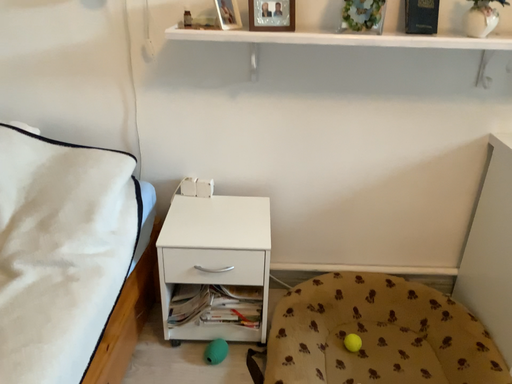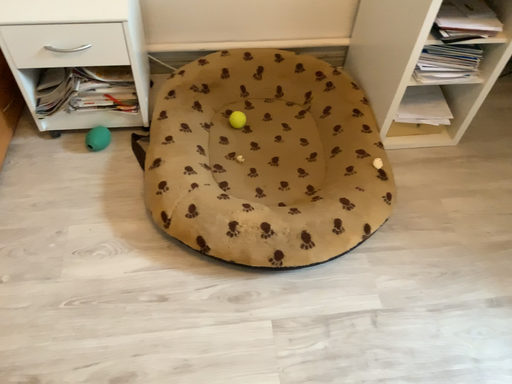
Question: Which way did the camera rotate in the video?

Choices:
 (A) rotated upward
 (B) rotated downward

Answer: (B)